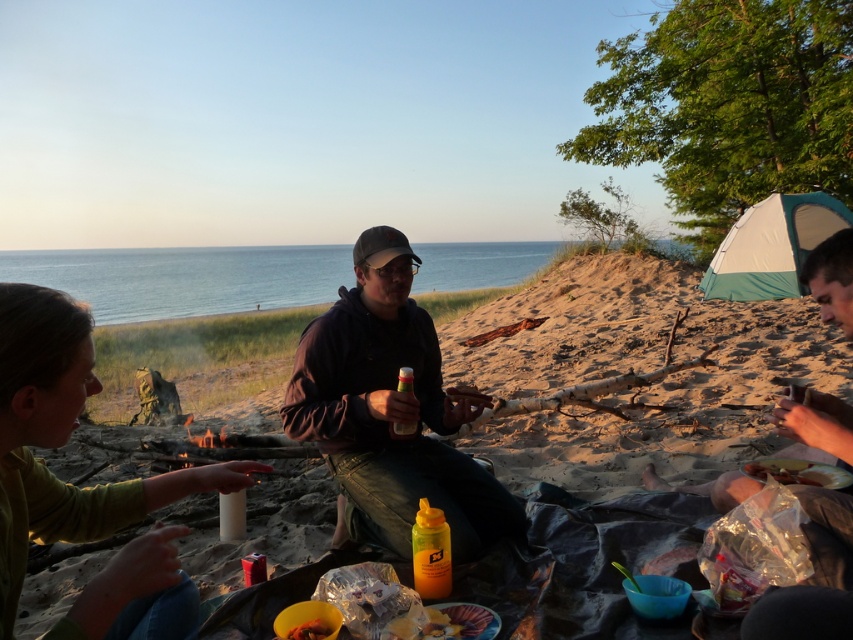
You are standing at the campfire and want to hand a snack from the shiny plastic container at lower center to the person in the green matte shirt at lower left. Can you reach them without moving from your current position?

The green matte shirt at lower left is closer to the viewer than the shiny plastic container at lower center, so yes, you can reach them without moving because the container is farther away but still within arm reach.

You are a hiker who just arrived at the campsite and see the dark brown leather jacket at center and the yellow plastic bottle at center. Which item is bigger?

The dark brown leather jacket at center is larger in size than the yellow plastic bottle at center.

You are standing at the point marked by coordinates point (390,412). What object are you standing on?

You are standing on the dark brown leather jacket at center.